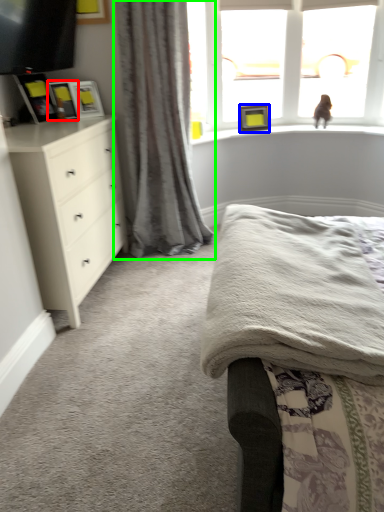
Question: Which is nearer to the picture frame (highlighted by a red box)? picture frame (highlighted by a blue box) or curtain (highlighted by a green box).

Choices:
 (A) picture frame
 (B) curtain

Answer: (B)